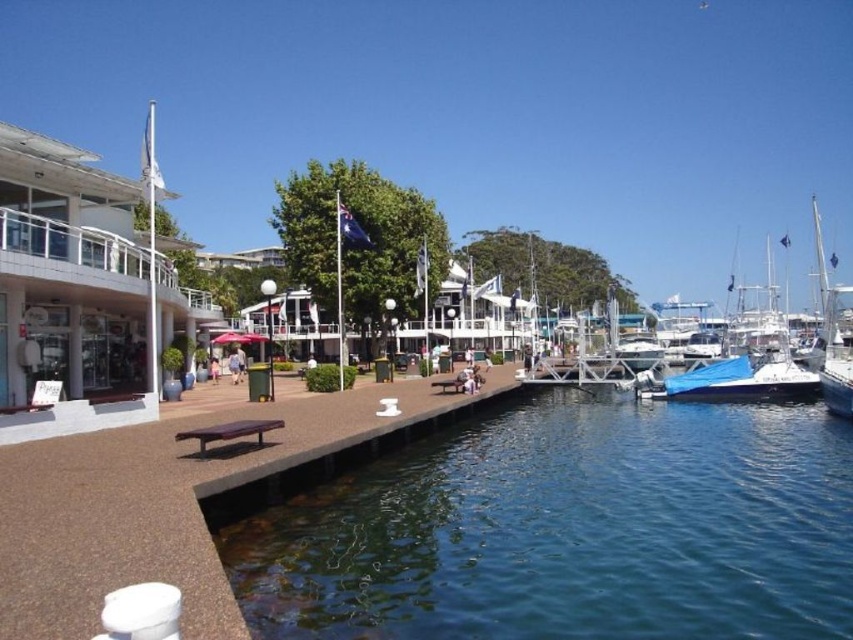
Is blue tarpaulin boat at right positioned at the back of brown wooden picnic table at center?

Yes, blue tarpaulin boat at right is behind brown wooden picnic table at center.

Who is shorter, blue tarpaulin boat at right or brown wooden picnic table at center?

With less height is brown wooden picnic table at center.

Does point (670, 378) come behind point (445, 384)?

That is True.

Find the location of `blue tarpaulin boat at right`. blue tarpaulin boat at right is located at coordinates (747, 371).

Is brown wood dock at center bigger than blue tarpaulin boat at right?

Actually, brown wood dock at center might be smaller than blue tarpaulin boat at right.

Based on the photo, can you confirm if brown wood dock at center is thinner than blue tarpaulin boat at right?

Indeed, brown wood dock at center has a lesser width compared to blue tarpaulin boat at right.

Is point (192, 518) positioned after point (744, 388)?

No, it is in front of (744, 388).

The width and height of the screenshot is (853, 640). I want to click on brown wood dock at center, so click(157, 506).

Does clear blue water at lower center appear on the right side of blue tarpaulin boat at right?

Incorrect, clear blue water at lower center is not on the right side of blue tarpaulin boat at right.

Looking at this image, can you confirm if clear blue water at lower center is positioned below blue tarpaulin boat at right?

Yes.

Describe the element at coordinates (567, 531) in the screenshot. I see `clear blue water at lower center` at that location.

Image resolution: width=853 pixels, height=640 pixels. I want to click on clear blue water at lower center, so click(x=567, y=531).